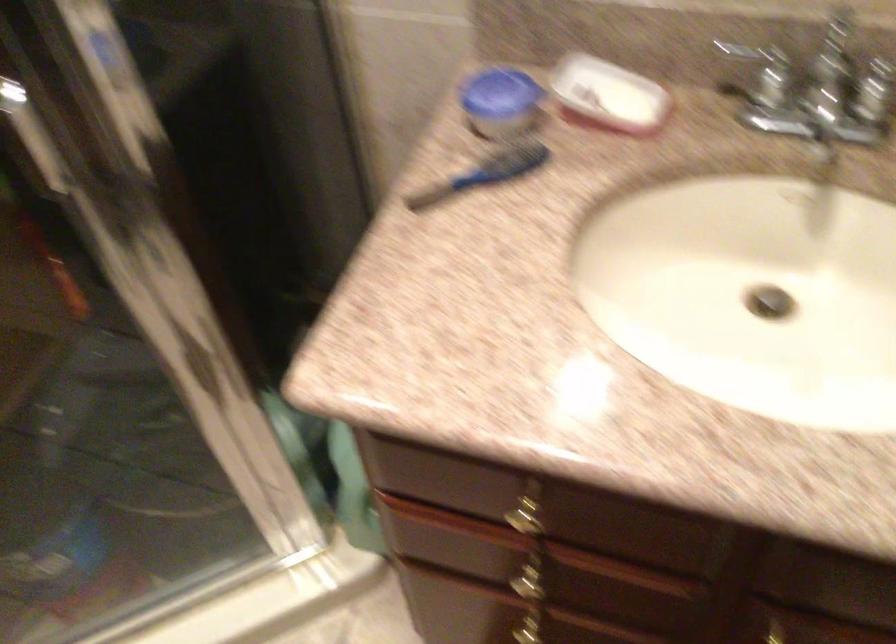
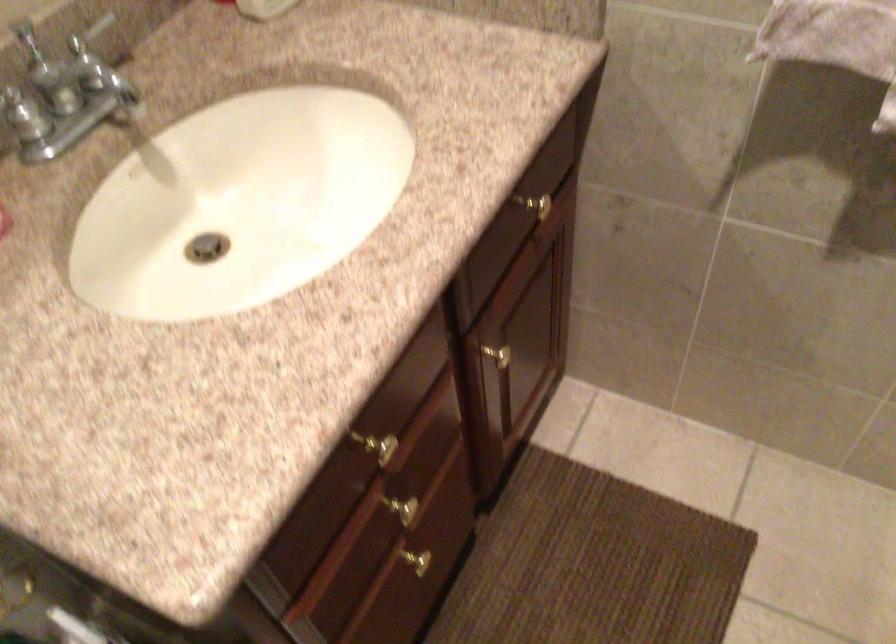
The first image is from the beginning of the video and the second image is from the end. How did the camera likely rotate when shooting the video?

The rotation direction of the camera is right-down.